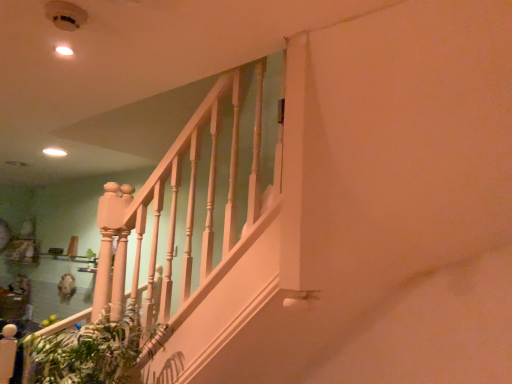
I want to click on green leafy plant at lower left, so click(x=90, y=351).

What is the approximate width of green leafy plant at lower left?

green leafy plant at lower left is 16.59 inches wide.

The width and height of the screenshot is (512, 384). Describe the element at coordinates (90, 351) in the screenshot. I see `green leafy plant at lower left` at that location.

Where is `green leafy plant at lower left`? The image size is (512, 384). green leafy plant at lower left is located at coordinates (90, 351).